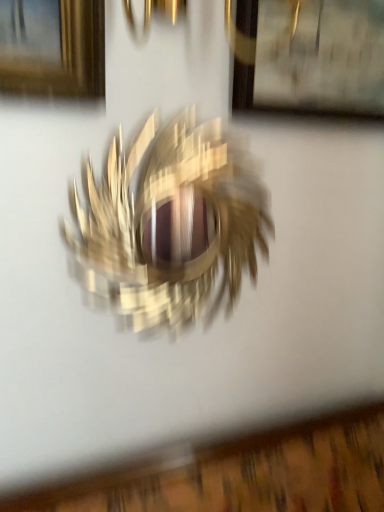
The width and height of the screenshot is (384, 512). I want to click on metallic gold bird at center, so click(169, 224).

What do you see at coordinates (169, 224) in the screenshot?
I see `metallic gold bird at center` at bounding box center [169, 224].

Image resolution: width=384 pixels, height=512 pixels. What do you see at coordinates (308, 55) in the screenshot?
I see `wooden picture frame at upper center` at bounding box center [308, 55].

Locate an element on the screen. wooden picture frame at upper center is located at coordinates (308, 55).

Where is `metallic gold bird at center`? Image resolution: width=384 pixels, height=512 pixels. metallic gold bird at center is located at coordinates (169, 224).

Is wooden picture frame at upper center to the left of metallic gold bird at center from the viewer's perspective?

Incorrect, wooden picture frame at upper center is not on the left side of metallic gold bird at center.

Considering the relative positions of wooden picture frame at upper center and metallic gold bird at center in the image provided, is wooden picture frame at upper center in front of metallic gold bird at center?

No, it is not.

Which point is more distant from viewer, (333, 87) or (90, 244)?

The point (333, 87) is farther from the camera.

From the image's perspective, is wooden picture frame at upper center on top of metallic gold bird at center?

Yes, from the image's perspective, wooden picture frame at upper center is on top of metallic gold bird at center.

From a real-world perspective, is wooden picture frame at upper center located higher than metallic gold bird at center?

Correct, in the physical world, wooden picture frame at upper center is higher than metallic gold bird at center.

Looking at their sizes, would you say wooden picture frame at upper center is wider or thinner than metallic gold bird at center?

wooden picture frame at upper center is wider than metallic gold bird at center.

Which of these two, wooden picture frame at upper center or metallic gold bird at center, stands taller?

With more height is metallic gold bird at center.

Based on their sizes in the image, would you say wooden picture frame at upper center is bigger or smaller than metallic gold bird at center?

Clearly, wooden picture frame at upper center is smaller in size than metallic gold bird at center.

Is wooden picture frame at upper center spatially inside metallic gold bird at center, or outside of it?

The correct answer is: outside.

Is wooden picture frame at upper center not close to metallic gold bird at center?

wooden picture frame at upper center is actually quite close to metallic gold bird at center.

Is metallic gold bird at center at the back of wooden picture frame at upper center?

No, wooden picture frame at upper center is not facing the opposite direction of metallic gold bird at center.

Locate an element on the screen. The height and width of the screenshot is (512, 384). picture frame on the right of metallic gold bird at center is located at coordinates (308, 55).

Considering the relative positions of metallic gold bird at center and wooden picture frame at upper center in the image provided, is metallic gold bird at center to the right of wooden picture frame at upper center from the viewer's perspective?

No, metallic gold bird at center is not to the right of wooden picture frame at upper center.

Considering the relative positions of metallic gold bird at center and wooden picture frame at upper center in the image provided, is metallic gold bird at center in front of wooden picture frame at upper center?

Yes, metallic gold bird at center is closer to the camera.

Is point (65, 231) less distant than point (337, 99)?

Yes, point (65, 231) is closer to viewer.

From the image's perspective, is metallic gold bird at center over wooden picture frame at upper center?

Incorrect, from the image's perspective, metallic gold bird at center is lower than wooden picture frame at upper center.

From a real-world perspective, is metallic gold bird at center on wooden picture frame at upper center?

Actually, metallic gold bird at center is physically below wooden picture frame at upper center in the real world.

Considering the sizes of objects metallic gold bird at center and wooden picture frame at upper center in the image provided, who is thinner, metallic gold bird at center or wooden picture frame at upper center?

With smaller width is metallic gold bird at center.

Is metallic gold bird at center taller than wooden picture frame at upper center?

Indeed, metallic gold bird at center has a greater height compared to wooden picture frame at upper center.

Based on the photo, considering the sizes of metallic gold bird at center and wooden picture frame at upper center in the image, is metallic gold bird at center bigger or smaller than wooden picture frame at upper center?

Considering their sizes, metallic gold bird at center takes up more space than wooden picture frame at upper center.

Consider the image. Is wooden picture frame at upper center surrounded by metallic gold bird at center?

No, wooden picture frame at upper center is located outside of metallic gold bird at center.

Is there a large distance between metallic gold bird at center and wooden picture frame at upper center?

No, metallic gold bird at center is not far from wooden picture frame at upper center.

Is metallic gold bird at center positioned with its back to wooden picture frame at upper center?

That's not correct — metallic gold bird at center is not looking away from wooden picture frame at upper center.

Locate an element on the screen. picture frame lying behind the metallic gold bird at center is located at coordinates (308, 55).

At what (x,y) coordinates should I click in order to perform the action: click on picture frame that appears on the right of metallic gold bird at center. Please return your answer as a coordinate pair (x, y). Image resolution: width=384 pixels, height=512 pixels. Looking at the image, I should click on (308, 55).

Image resolution: width=384 pixels, height=512 pixels. What are the coordinates of `bird that is below the wooden picture frame at upper center (from the image's perspective)` in the screenshot? It's located at (169, 224).